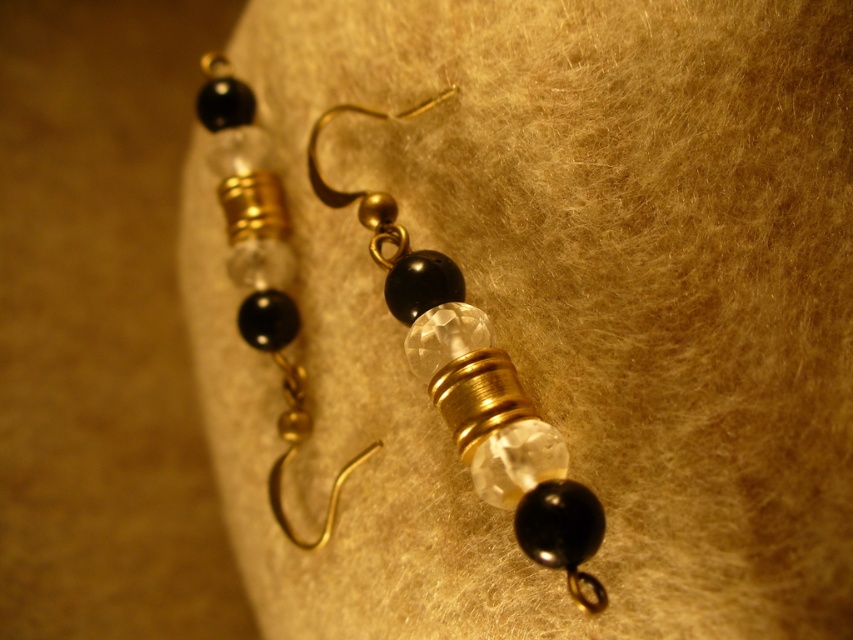
Does matte gold hook at center have a larger size compared to clear crystal bead at center?

Indeed, matte gold hook at center has a larger size compared to clear crystal bead at center.

Which is above, matte gold hook at center or clear crystal bead at center?

clear crystal bead at center

Find the location of a particular element. This screenshot has width=853, height=640. matte gold hook at center is located at coordinates [477, 387].